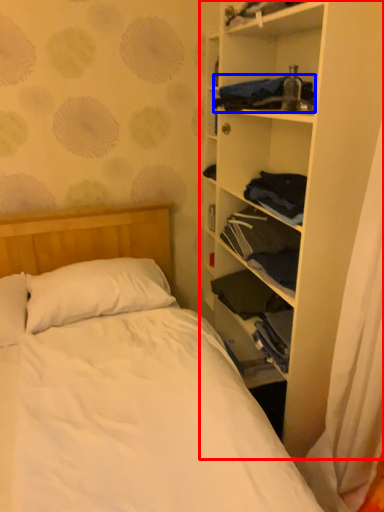
Question: Which object appears farthest to the camera in this image, shelf (highlighted by a red box) or clothing (highlighted by a blue box)?

Choices:
 (A) shelf
 (B) clothing

Answer: (B)